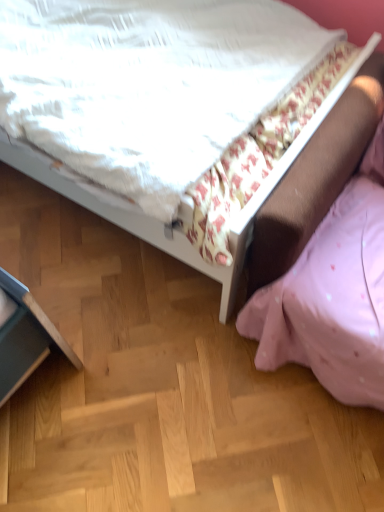
Question: Should I look upward or downward to see white fabric bed at upper center?

Choices:
 (A) down
 (B) up

Answer: (B)